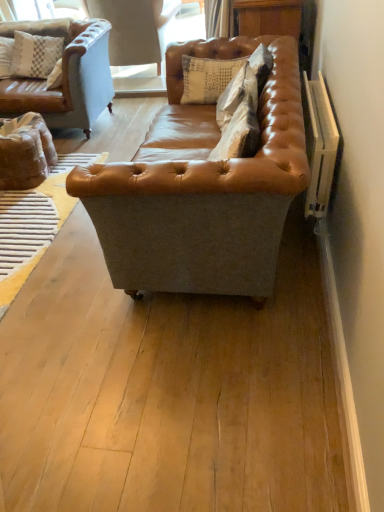
Question: Looking at their shapes, would you say leather/cushion at center, which is the second pillow in front-to-back order, is wider or thinner than light blue leather swivel chair at upper left?

Choices:
 (A) wide
 (B) thin

Answer: (B)

Question: Considering the positions of point (210, 68) and point (140, 12), is point (210, 68) closer or farther from the camera than point (140, 12)?

Choices:
 (A) closer
 (B) farther

Answer: (A)

Question: Which object is the farthest from the light blue leather swivel chair at upper left?

Choices:
 (A) suede textured pillow at center, arranged as the second pillow when viewed from the back
 (B) saddle brown leather couch at center
 (C) leather/cushion at center, acting as the 1th pillow starting from the back

Answer: (A)

Question: Estimate the real-world distances between objects in this image. Which object is closer to the saddle brown leather couch at center?

Choices:
 (A) light blue leather swivel chair at upper left
 (B) leather/cushion at center, which ranks as the 2th pillow in bottom-to-top order
 (C) suede textured pillow at center, marked as the first pillow in a bottom-to-top arrangement

Answer: (C)